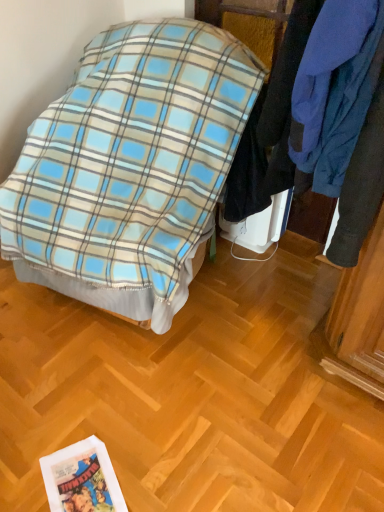
Question: Can you confirm if blue plaid blanket at center is positioned to the right of blue fleece jacket at upper right?

Choices:
 (A) yes
 (B) no

Answer: (B)

Question: Is blue plaid blanket at center next to blue fleece jacket at upper right and touching it?

Choices:
 (A) yes
 (B) no

Answer: (B)

Question: Does blue plaid blanket at center appear on the left side of blue fleece jacket at upper right?

Choices:
 (A) yes
 (B) no

Answer: (A)

Question: Can you confirm if blue plaid blanket at center is taller than blue fleece jacket at upper right?

Choices:
 (A) no
 (B) yes

Answer: (B)

Question: Can you confirm if blue plaid blanket at center is smaller than blue fleece jacket at upper right?

Choices:
 (A) no
 (B) yes

Answer: (A)

Question: Is the position of blue plaid blanket at center less distant than that of blue fleece jacket at upper right?

Choices:
 (A) no
 (B) yes

Answer: (A)

Question: Can we say blue fleece jacket at upper right lies outside blue plaid blanket at center?

Choices:
 (A) yes
 (B) no

Answer: (A)

Question: Are blue fleece jacket at upper right and blue plaid blanket at center far apart?

Choices:
 (A) yes
 (B) no

Answer: (B)

Question: Is blue fleece jacket at upper right surrounding blue plaid blanket at center?

Choices:
 (A) no
 (B) yes

Answer: (A)

Question: Is blue fleece jacket at upper right positioned with its back to blue plaid blanket at center?

Choices:
 (A) no
 (B) yes

Answer: (A)

Question: Is blue fleece jacket at upper right facing towards blue plaid blanket at center?

Choices:
 (A) no
 (B) yes

Answer: (A)

Question: Is blue fleece jacket at upper right thinner than blue plaid blanket at center?

Choices:
 (A) yes
 (B) no

Answer: (A)

Question: Would you say blue plaid blanket at center is inside or outside blue fleece jacket at upper right?

Choices:
 (A) inside
 (B) outside

Answer: (B)